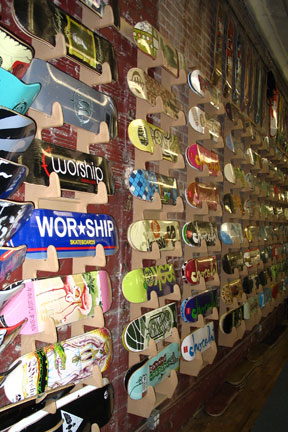
I want to click on red brick wall, so click(x=130, y=5), click(x=126, y=405), click(x=115, y=320), click(x=116, y=291), click(x=10, y=349), click(x=115, y=264), click(x=65, y=266), click(x=122, y=53), click(x=121, y=202).